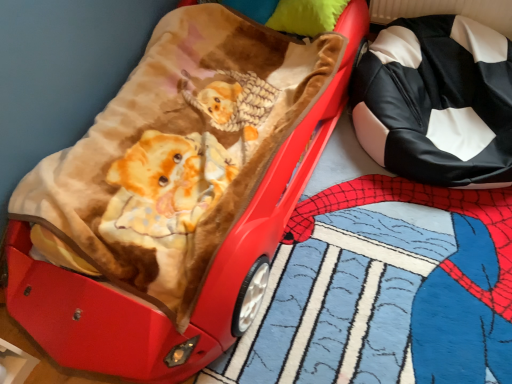
Question: Considering the relative sizes of black/white leather pillow at right and velvet-like brown blanket at upper left in the image provided, is black/white leather pillow at right taller than velvet-like brown blanket at upper left?

Choices:
 (A) no
 (B) yes

Answer: (A)

Question: Can you confirm if black/white leather pillow at right is bigger than velvet-like brown blanket at upper left?

Choices:
 (A) yes
 (B) no

Answer: (B)

Question: Is black/white leather pillow at right at the right side of velvet-like brown blanket at upper left?

Choices:
 (A) no
 (B) yes

Answer: (B)

Question: From a real-world perspective, is black/white leather pillow at right positioned under velvet-like brown blanket at upper left based on gravity?

Choices:
 (A) yes
 (B) no

Answer: (A)

Question: Is black/white leather pillow at right oriented away from velvet-like brown blanket at upper left?

Choices:
 (A) no
 (B) yes

Answer: (A)

Question: Could you tell me if black/white leather pillow at right is turned towards velvet-like brown blanket at upper left?

Choices:
 (A) no
 (B) yes

Answer: (A)

Question: Can you confirm if velvet-like brown blanket at upper left is wider than black/white leather pillow at right?

Choices:
 (A) yes
 (B) no

Answer: (A)

Question: From a real-world perspective, is velvet-like brown blanket at upper left positioned over black/white leather pillow at right based on gravity?

Choices:
 (A) no
 (B) yes

Answer: (B)

Question: Does velvet-like brown blanket at upper left appear on the left side of black/white leather pillow at right?

Choices:
 (A) no
 (B) yes

Answer: (B)

Question: Does velvet-like brown blanket at upper left appear on the right side of black/white leather pillow at right?

Choices:
 (A) no
 (B) yes

Answer: (A)

Question: From the image's perspective, is velvet-like brown blanket at upper left over black/white leather pillow at right?

Choices:
 (A) yes
 (B) no

Answer: (B)

Question: Is velvet-like brown blanket at upper left further to camera compared to black/white leather pillow at right?

Choices:
 (A) yes
 (B) no

Answer: (B)

Question: Considering the positions of velvet-like brown blanket at upper left and black/white leather pillow at right in the image, is velvet-like brown blanket at upper left taller or shorter than black/white leather pillow at right?

Choices:
 (A) short
 (B) tall

Answer: (B)